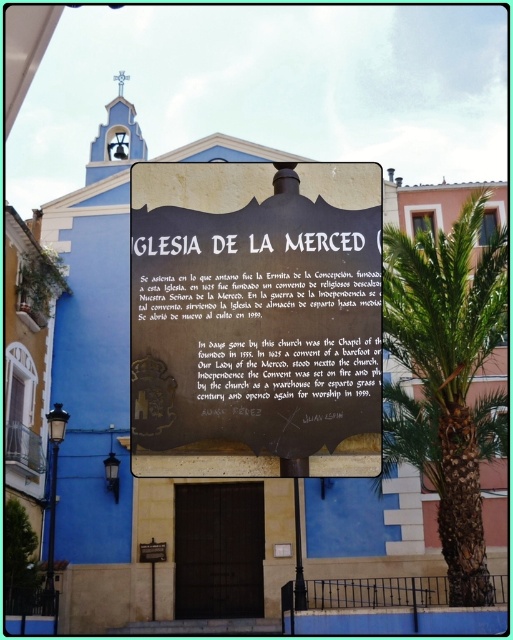
Question: Which of the following is the closest to the observer?

Choices:
 (A) black polished stone sign at center
 (B) green leafy palm tree at right

Answer: (A)

Question: Which object is the farthest from the black polished stone sign at center?

Choices:
 (A) green leafy palm tree at right
 (B) metallic plaque at lower center

Answer: (B)

Question: Does green leafy palm tree at right appear under metallic plaque at lower center?

Choices:
 (A) yes
 (B) no

Answer: (B)

Question: Which of the following is the farthest from the observer?

Choices:
 (A) metallic plaque at lower center
 (B) black polished stone sign at center
 (C) green leafy palm tree at right

Answer: (A)

Question: Is green leafy palm tree at right above metallic plaque at lower center?

Choices:
 (A) no
 (B) yes

Answer: (B)

Question: Is green leafy palm tree at right closer to camera compared to metallic plaque at lower center?

Choices:
 (A) no
 (B) yes

Answer: (B)